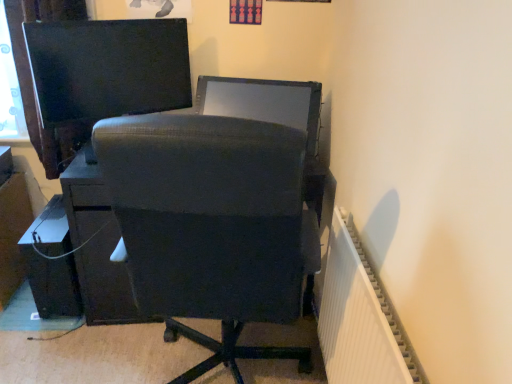
Question: Looking at their shapes, would you say matte black cable at lower left is wider or thinner than satin black monitor at center, which is counted as the 1th computer monitor, starting from the right?

Choices:
 (A) wide
 (B) thin

Answer: (A)

Question: From a real-world perspective, relative to satin black monitor at center, the second computer monitor in the left-to-right sequence, is matte black cable at lower left vertically above or below?

Choices:
 (A) below
 (B) above

Answer: (A)

Question: Based on their relative distances, which object is nearer to the white ribbed radiator at right?

Choices:
 (A) matte black cable at lower left
 (B) matte black file cabinet at lower left
 (C) matte black chair at center
 (D) matte black monitor at upper left, which ranks as the 1th computer monitor in left-to-right order
 (E) satin black monitor at center, the second computer monitor in the left-to-right sequence

Answer: (C)

Question: Which is farther from the white ribbed radiator at right?

Choices:
 (A) matte black cable at lower left
 (B) matte black chair at center
 (C) matte black file cabinet at lower left
 (D) matte black monitor at upper left, which ranks as the 1th computer monitor in left-to-right order
 (E) satin black monitor at center, which is counted as the 1th computer monitor, starting from the right

Answer: (C)